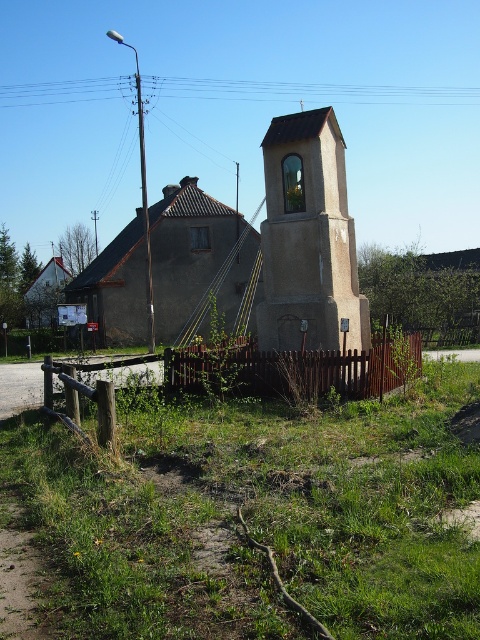
Question: Which is nearer to the gray concrete church at center?

Choices:
 (A) wooden picket fence at center
 (B) brown concrete church at center
 (C) smooth concrete bell tower at center

Answer: (B)

Question: Is brown concrete church at center smaller than brown wooden fence at center?

Choices:
 (A) no
 (B) yes

Answer: (A)

Question: Does smooth concrete bell tower at center appear over gray concrete church at center?

Choices:
 (A) no
 (B) yes

Answer: (A)

Question: Which object is farther from the camera taking this photo?

Choices:
 (A) brown concrete church at center
 (B) brown wooden fence at center

Answer: (A)

Question: Which object appears closest to the camera in this image?

Choices:
 (A) gray concrete church at center
 (B) brown wooden fence at center
 (C) wooden picket fence at center
 (D) brown concrete church at center

Answer: (B)

Question: Does gray concrete church at center have a larger size compared to wooden picket fence at center?

Choices:
 (A) yes
 (B) no

Answer: (A)